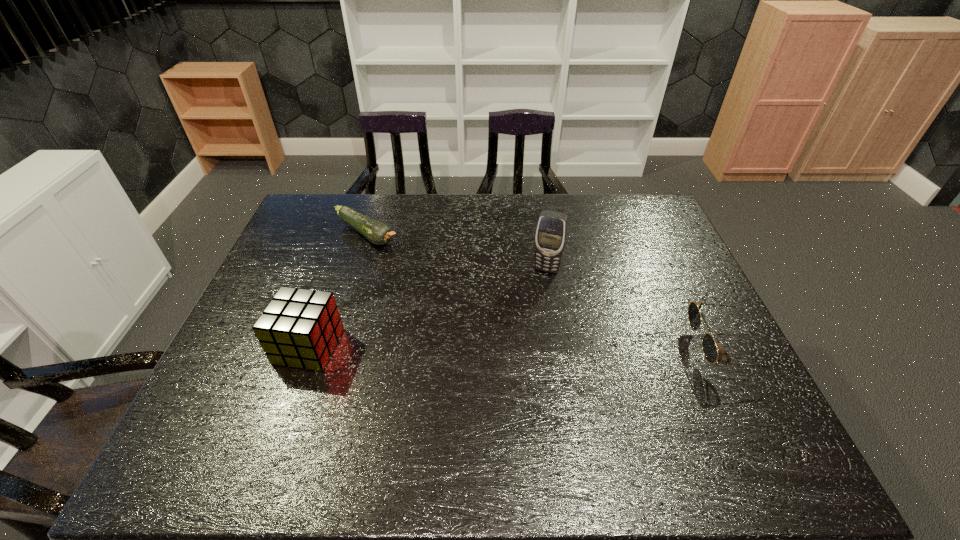
Identify the location of object at the right edge. (709, 347).

Identify the location of object situated at the far left corner. [x=378, y=233].

At what (x,y) coordinates should I click in order to perform the action: click on free region at the far edge of the desktop. Please return your answer as a coordinate pair (x, y). This screenshot has width=960, height=540. Looking at the image, I should click on (469, 202).

Image resolution: width=960 pixels, height=540 pixels. In the image, there is a desktop. What are the coordinates of `free space at the left edge` in the screenshot? It's located at (292, 286).

In the image, there is a desktop. Identify the location of vacant area at the right edge. This screenshot has width=960, height=540. (706, 367).

Where is `free spot at the far right corner of the desktop`? free spot at the far right corner of the desktop is located at coordinates (618, 201).

This screenshot has height=540, width=960. In order to click on free space that is in between the second tallest object and the shortest object in this screenshot , I will do `click(338, 290)`.

Image resolution: width=960 pixels, height=540 pixels. What are the coordinates of `vacant region between the cellular telephone and the sunglasses` in the screenshot? It's located at (636, 308).

I want to click on vacant area that lies between the rightmost object and the third object from left to right, so pyautogui.click(x=636, y=308).

Identify the location of free space between the zucchini and the second object from right to left. (457, 252).